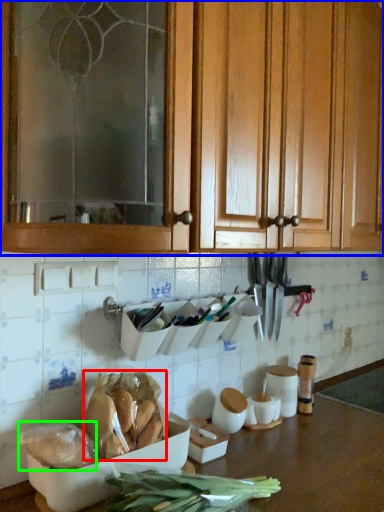
Question: Which object is the farthest from food (highlighted by a red box)? Choose among these: cabinetry (highlighted by a blue box) or food (highlighted by a green box).

Choices:
 (A) cabinetry
 (B) food

Answer: (A)